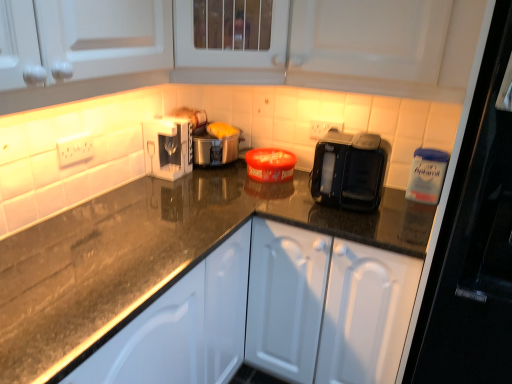
Question: Is white matte cabinet at center bigger than white glossy coffee machine at upper center?

Choices:
 (A) yes
 (B) no

Answer: (A)

Question: From the image's perspective, is white matte cabinet at center located beneath white glossy coffee machine at upper center?

Choices:
 (A) yes
 (B) no

Answer: (A)

Question: Does white matte cabinet at center have a lesser height compared to white glossy coffee machine at upper center?

Choices:
 (A) yes
 (B) no

Answer: (B)

Question: From a real-world perspective, is white matte cabinet at center located beneath white glossy coffee machine at upper center?

Choices:
 (A) no
 (B) yes

Answer: (B)

Question: Is white matte cabinet at center wider than white glossy coffee machine at upper center?

Choices:
 (A) yes
 (B) no

Answer: (A)

Question: Could you tell me if white matte cabinet at center is facing white glossy coffee machine at upper center?

Choices:
 (A) no
 (B) yes

Answer: (A)

Question: Is white glossy coffee machine at upper center to the right of white matte cabinet at center from the viewer's perspective?

Choices:
 (A) yes
 (B) no

Answer: (B)

Question: Is white glossy coffee machine at upper center not inside white matte cabinet at center?

Choices:
 (A) yes
 (B) no

Answer: (A)

Question: From the image's perspective, is white glossy coffee machine at upper center beneath white matte cabinet at center?

Choices:
 (A) yes
 (B) no

Answer: (B)

Question: Considering the relative sizes of white glossy coffee machine at upper center and white matte cabinet at center in the image provided, is white glossy coffee machine at upper center shorter than white matte cabinet at center?

Choices:
 (A) yes
 (B) no

Answer: (A)

Question: Can you confirm if white glossy coffee machine at upper center is wider than white matte cabinet at center?

Choices:
 (A) no
 (B) yes

Answer: (A)

Question: Can you confirm if white glossy coffee machine at upper center is smaller than white matte cabinet at center?

Choices:
 (A) yes
 (B) no

Answer: (A)

Question: Is matte plastic toaster at center located within white matte cabinet at center?

Choices:
 (A) no
 (B) yes

Answer: (A)